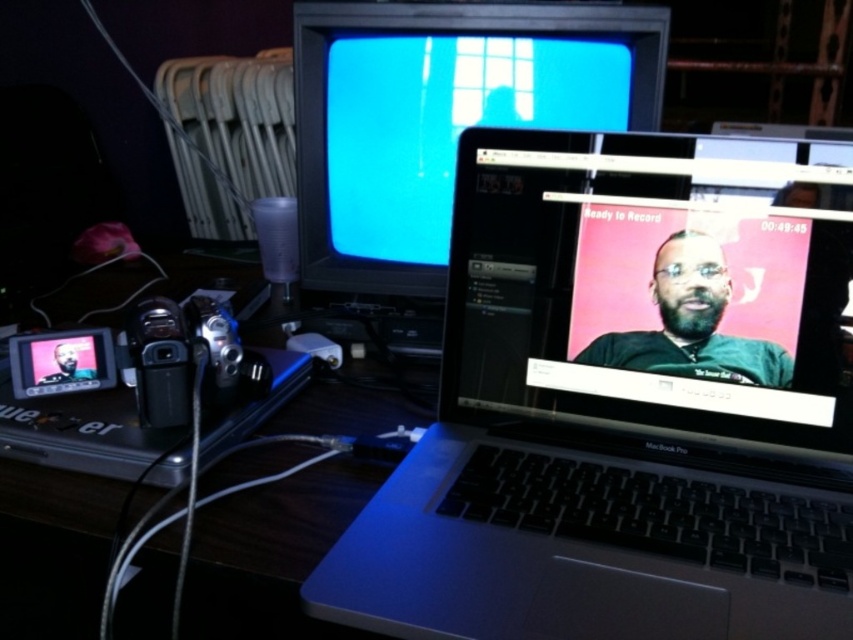
You are setting up a video call and need to adjust the camera angle. Which object, the matte black monitor at upper center or the satin black camera at left, is taller and thus might block the camera view if positioned directly in front?

The matte black monitor at upper center is taller than the satin black camera at left, so it might block the camera view if positioned directly in front.

You are trying to locate the sleek silver laptop at center in the workspace. What are the coordinates where you should look?

The sleek silver laptop at center is located at coordinates point (624, 404).

You are setting up a video call and need to position two cameras for optimal angles. You have a satin black camera at left and a silver plastic video camera at lower left. Which camera is positioned more to the right?

The satin black camera at left is positioned more to the right than the silver plastic video camera at lower left.